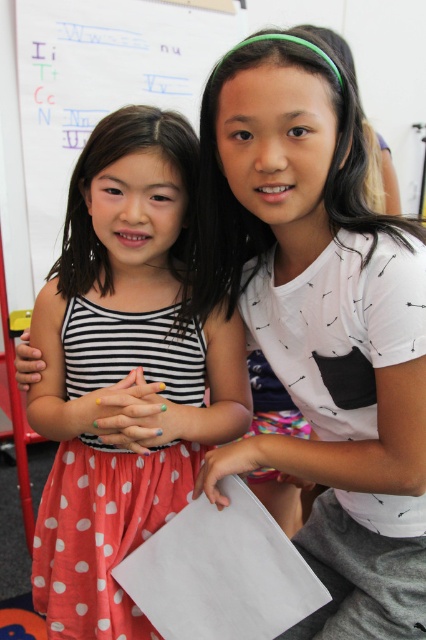
You are a photographer standing in front of the two girls. You need to take a photo that includes both the polka dot fabric dress at center and the white paper at upper center. Considering the distance between them, will you need to zoom in or zoom out to ensure both are fully visible in the frame?

The polka dot fabric dress at center and white paper at upper center are 5.10 feet apart from each other. To include both in the frame without cropping either, you would need to zoom out to widen the field of view so that the 5.10 feet distance between them fits within the camera frame.

You are a photographer setting up for a group photo in the classroom. You notice the white printed shirt at upper right and the white paper at upper center. Which object takes up more space in the image?

The white paper at upper center takes up more space in the image than the white printed shirt at upper right.